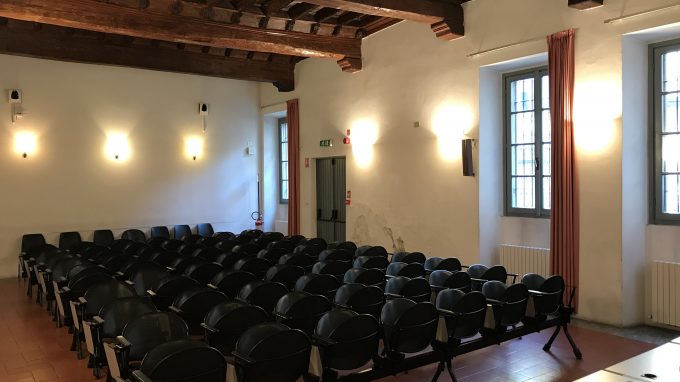
Identify the location of curtain. (566, 223).